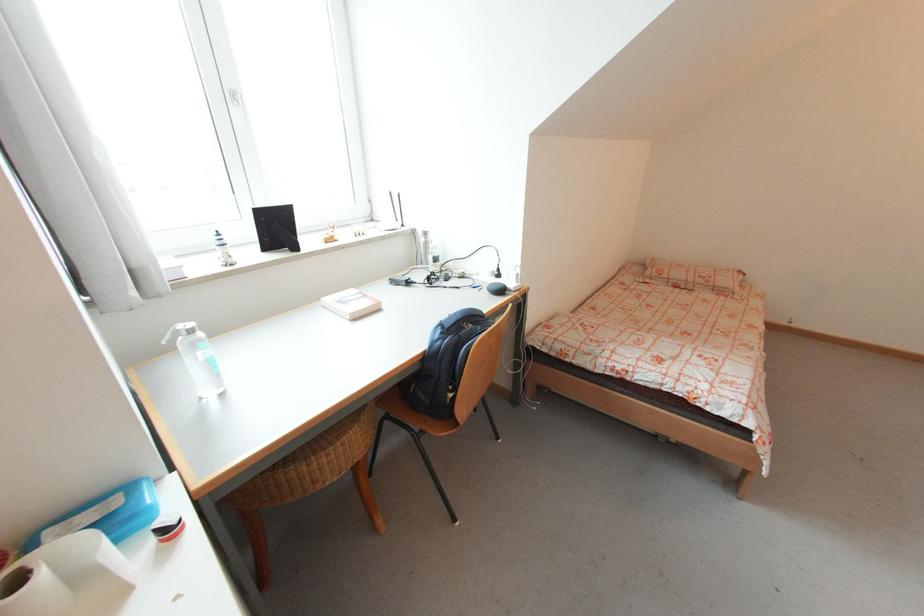
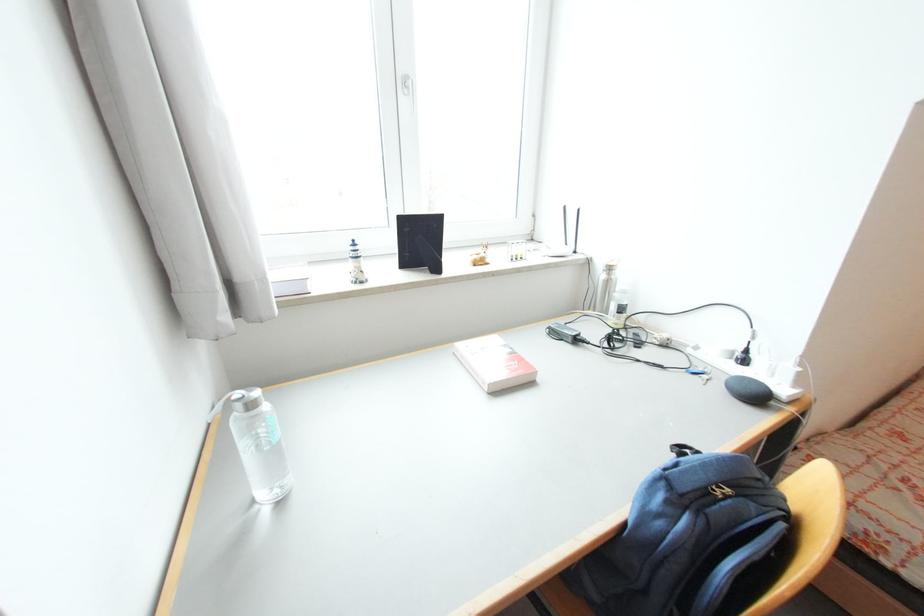
Locate, in the second image, the point that corresponds to point 479,286 in the first image.

(697, 370)